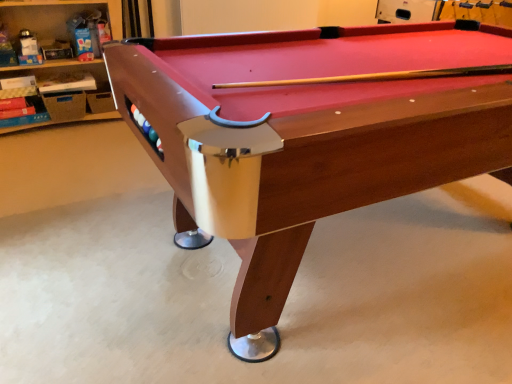
Question: Looking at their shapes, would you say wooden pool table at center is wider or thinner than wooden shelves at left?

Choices:
 (A) thin
 (B) wide

Answer: (B)

Question: From a real-world perspective, is wooden pool table at center above or below wooden shelves at left?

Choices:
 (A) below
 (B) above

Answer: (B)

Question: Relative to wooden shelves at left, is wooden pool table at center in front or behind?

Choices:
 (A) behind
 (B) front

Answer: (B)

Question: Considering their positions, is wooden shelves at left located in front of or behind wooden pool table at center?

Choices:
 (A) behind
 (B) front

Answer: (A)

Question: Considering the positions of wooden shelves at left and wooden pool table at center in the image, is wooden shelves at left taller or shorter than wooden pool table at center?

Choices:
 (A) tall
 (B) short

Answer: (B)

Question: From the image's perspective, relative to wooden pool table at center, is wooden shelves at left above or below?

Choices:
 (A) below
 (B) above

Answer: (B)

Question: Looking at their shapes, would you say wooden shelves at left is wider or thinner than wooden pool table at center?

Choices:
 (A) thin
 (B) wide

Answer: (A)